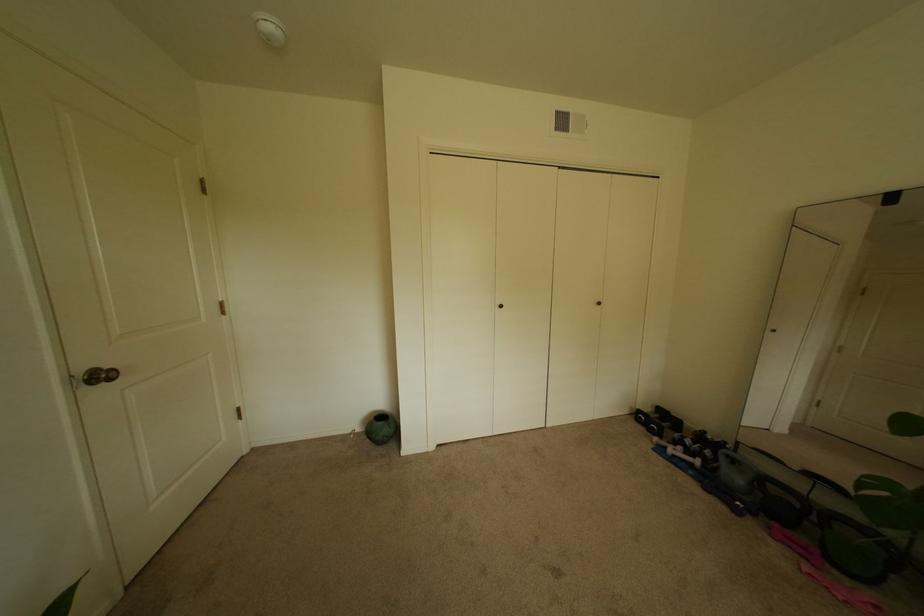
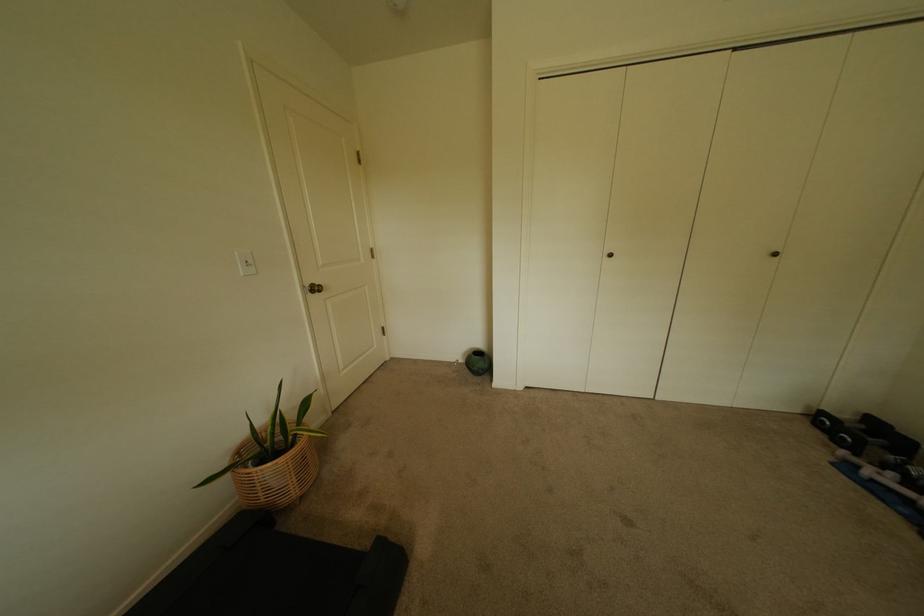
In the second image, find the point that corresponds to pixel 89 373 in the first image.

(315, 286)